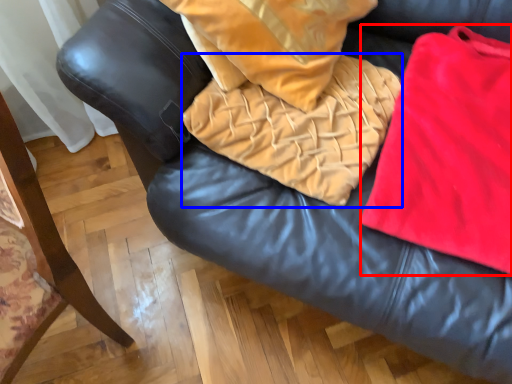
Question: Which of the following is the farthest to the observer, cloth (highlighted by a red box) or blanket (highlighted by a blue box)?

Choices:
 (A) cloth
 (B) blanket

Answer: (B)